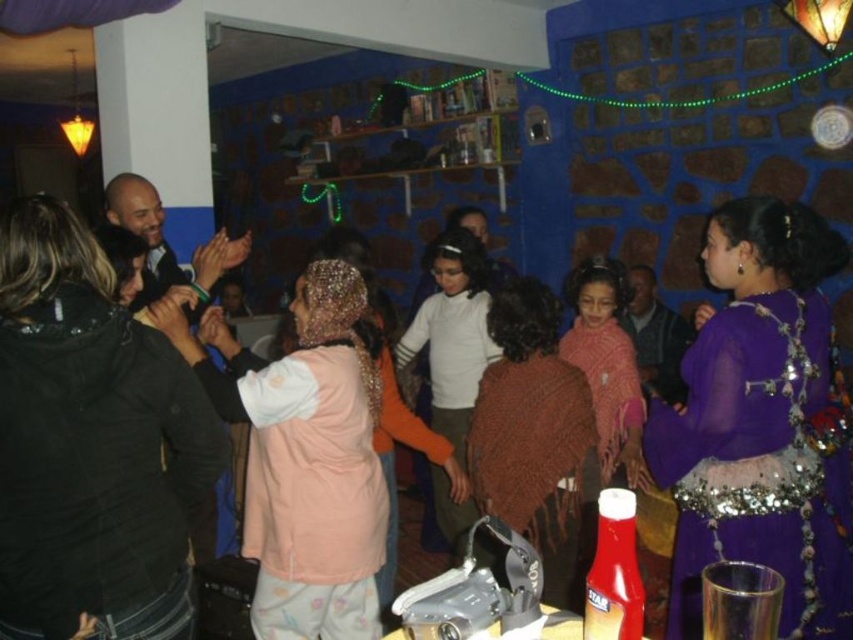
From the picture: You are a photographer at the event and want to capture both the black leather jacket at left and the purple sequined dress at center in a single shot. Which object should you focus on first to ensure both are in frame?

The black leather jacket at left is shorter than the purple sequined dress at center, so focusing on the purple sequined dress at center first will help ensure both are in frame.

You are a photographer trying to capture a candid shot of the celebration. You notice the knitted brown shawl at center and the white matte sweater at center. Which item is blocking the view of the other?

The knitted brown shawl at center is in front of the white matte sweater at center, so it is blocking the view of the white matte sweater at center.

You are at a cultural event and see two items at the center of the scene. The knitted brown shawl at center and the white matte sweater at center. Which one is positioned to the right?

The knitted brown shawl at center is to the right of the white matte sweater at center.